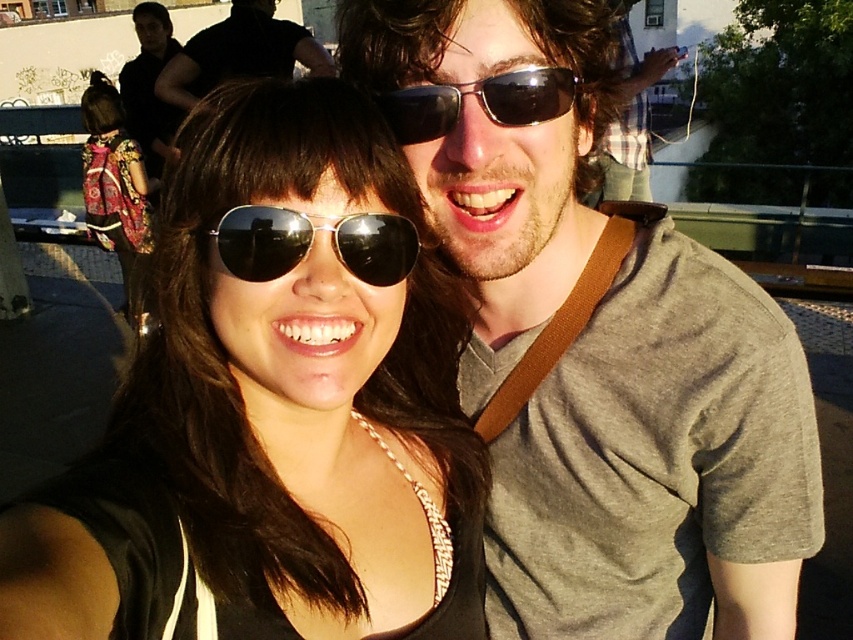
Question: Which point is farther from the camera taking this photo?

Choices:
 (A) (387, 109)
 (B) (300, 628)

Answer: (A)

Question: Can you confirm if matte black sunglasses at center is positioned to the right of gray cotton t-shirt at upper right?

Choices:
 (A) yes
 (B) no

Answer: (B)

Question: Is gray cotton t-shirt at upper right to the right of black matte shirt at upper left from the viewer's perspective?

Choices:
 (A) no
 (B) yes

Answer: (B)

Question: Can you confirm if patterned fabric dress at left is wider than black matte shirt at upper left?

Choices:
 (A) no
 (B) yes

Answer: (A)

Question: Which point is farther to the camera?

Choices:
 (A) pyautogui.click(x=424, y=104)
 (B) pyautogui.click(x=142, y=209)
 (C) pyautogui.click(x=753, y=468)
 (D) pyautogui.click(x=318, y=298)

Answer: (B)

Question: Estimate the real-world distances between objects in this image. Which object is farther from the black reflective sunglasses at upper center?

Choices:
 (A) matte black sunglasses at center
 (B) gray cotton t-shirt at upper right
 (C) black matte shirt at upper left

Answer: (C)